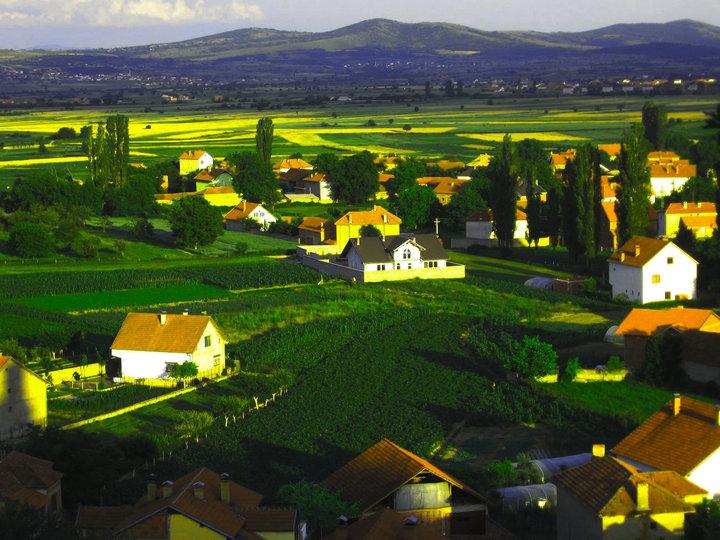
Locate an element on the screen. Image resolution: width=720 pixels, height=540 pixels. chimney is located at coordinates (222, 486).